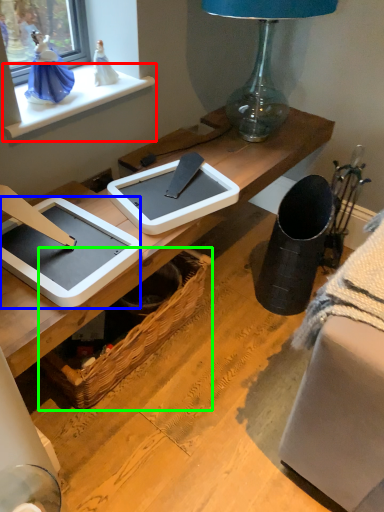
Question: Estimate the real-world distances between objects in this image. Which object is closer to window sill (highlighted by a red box), tablet computer (highlighted by a blue box) or picnic basket (highlighted by a green box)?

Choices:
 (A) tablet computer
 (B) picnic basket

Answer: (A)